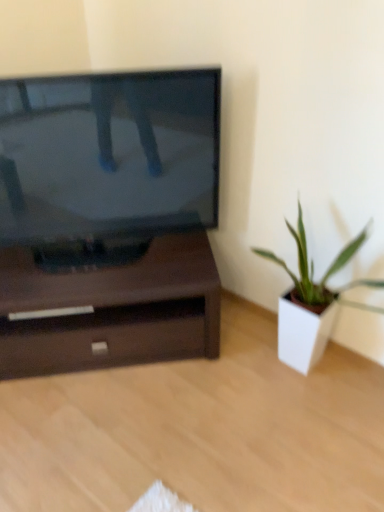
The width and height of the screenshot is (384, 512). What are the coordinates of `free spot below green matte plant at right (from a real-world perspective)` in the screenshot? It's located at (326, 389).